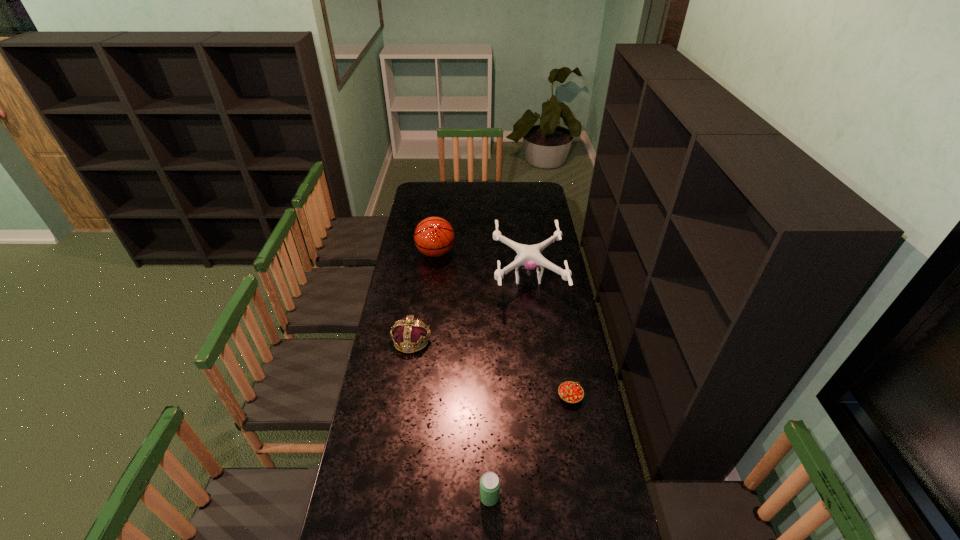
The width and height of the screenshot is (960, 540). Find the location of `vacant space located 0.290m on the top of the drone`. vacant space located 0.290m on the top of the drone is located at coordinates coord(435,278).

Locate an element on the screen. This screenshot has height=540, width=960. vacant space located on the back of the third farthest object is located at coordinates (419, 296).

At what (x,y) coordinates should I click in order to perform the action: click on vacant region located 0.090m on the front of the soda. Please return your answer as a coordinate pair (x, y). Image resolution: width=960 pixels, height=540 pixels. Looking at the image, I should click on (491, 539).

Where is `vacant space located on the back of the second nearest object`? The image size is (960, 540). vacant space located on the back of the second nearest object is located at coordinates (560, 339).

This screenshot has width=960, height=540. Identify the location of basketball that is at the left edge. (434, 236).

Where is `crown present at the left edge`? crown present at the left edge is located at coordinates (410, 331).

Locate an element on the screen. This screenshot has height=540, width=960. drone located at the right edge is located at coordinates coord(528,257).

I want to click on strawberry situated at the right edge, so click(x=571, y=392).

In the image, there is a desktop. Where is `vacant space at the far edge`? Image resolution: width=960 pixels, height=540 pixels. vacant space at the far edge is located at coordinates (448, 185).

In the image, there is a desktop. Where is `vacant space at the left edge`? vacant space at the left edge is located at coordinates (420, 272).